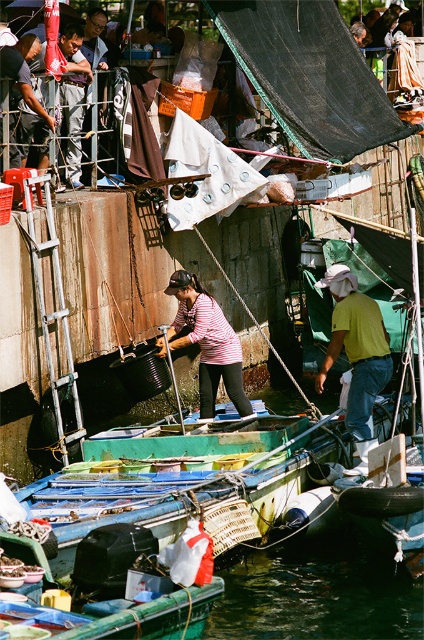
You are standing on the dock looking at the boat. Which object is positioned to the right of the other between the dark green water at lower center and the matte black shirt at center?

The dark green water at lower center is positioned to the right of the matte black shirt at center.